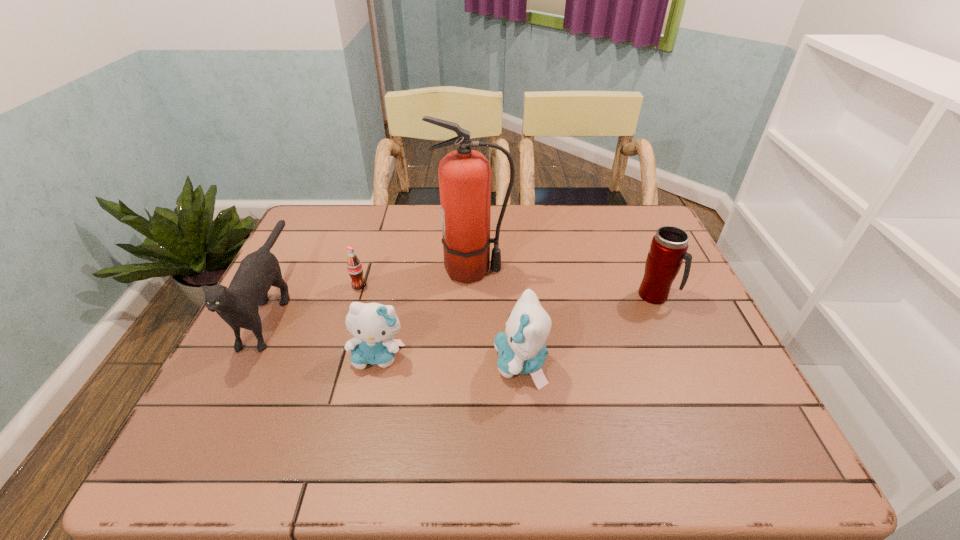
Find the location of a particular element. free region at the near edge is located at coordinates (410, 385).

The height and width of the screenshot is (540, 960). Find the location of `free point at the left edge`. free point at the left edge is located at coordinates (245, 334).

Find the location of a particular element. The width and height of the screenshot is (960, 540). blank space at the right edge of the desktop is located at coordinates (699, 338).

The image size is (960, 540). In the image, there is a desktop. Identify the location of blank space at the far left corner. (315, 236).

In the image, there is a desktop. In order to click on vacant space at the far right corner in this screenshot , I will do `click(649, 222)`.

The width and height of the screenshot is (960, 540). What are the coordinates of `empty space that is in between the soda and the tallest object` in the screenshot? It's located at (416, 278).

Identify the location of unoccupied position between the cat and the rightmost object. (464, 301).

This screenshot has width=960, height=540. I want to click on empty location between the shorter kitten and the right kitten, so click(x=449, y=360).

Identify the location of unoccupied position between the rightmost object and the right kitten. (588, 329).

Find the location of a particular element. This screenshot has height=540, width=960. free space between the right kitten and the left kitten is located at coordinates (449, 360).